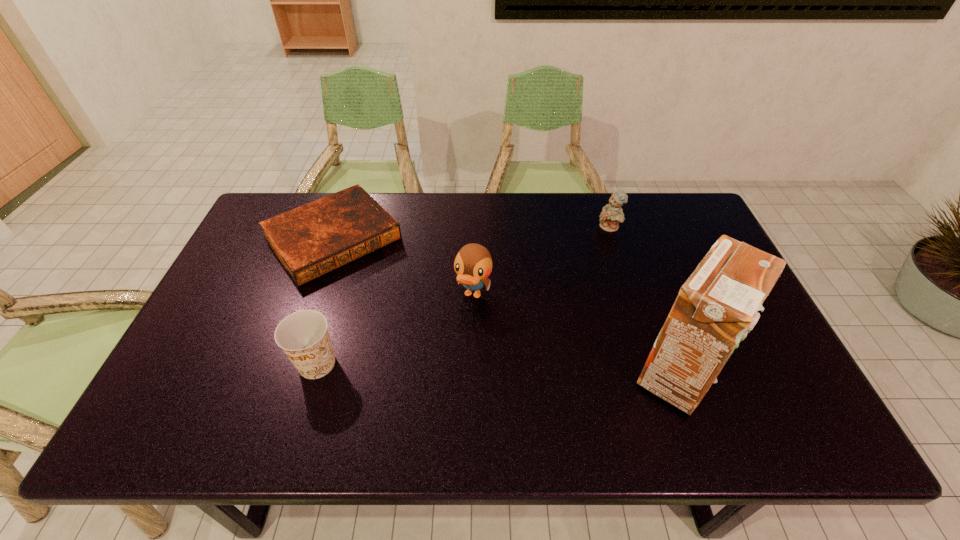
The height and width of the screenshot is (540, 960). Identify the location of free spot between the teddy bear and the Dixie cup. (463, 296).

At what (x,y) coordinates should I click in order to perform the action: click on blank region between the fourth shortest object and the shortest object. Please return your answer as a coordinate pair (x, y). The width and height of the screenshot is (960, 540). Looking at the image, I should click on (403, 266).

Where is `free space between the Dixie cup and the teddy bear`? The height and width of the screenshot is (540, 960). free space between the Dixie cup and the teddy bear is located at coordinates (463, 296).

In order to click on vacant space in between the tallest object and the Dixie cup in this screenshot , I will do [498, 369].

Locate an element on the screen. The height and width of the screenshot is (540, 960). empty location between the shortest object and the Dixie cup is located at coordinates (324, 301).

Identify the location of vacant space in between the Dixie cup and the carton. The width and height of the screenshot is (960, 540). coord(498,369).

The height and width of the screenshot is (540, 960). What are the coordinates of `vacant area that lies between the Bible and the tallest object` in the screenshot? It's located at (506, 306).

Image resolution: width=960 pixels, height=540 pixels. Identify the location of empty space between the teddy bear and the third object from right to left. (541, 261).

What are the coordinates of `vacant space in between the tallest object and the teddy bear` in the screenshot? It's located at (644, 301).

Select which object appears as the third closest to the Dixie cup. Please provide its 2D coordinates. Your answer should be formatted as a tuple, i.e. [(x, y)], where the tuple contains the x and y coordinates of a point satisfying the conditions above.

[(718, 303)]